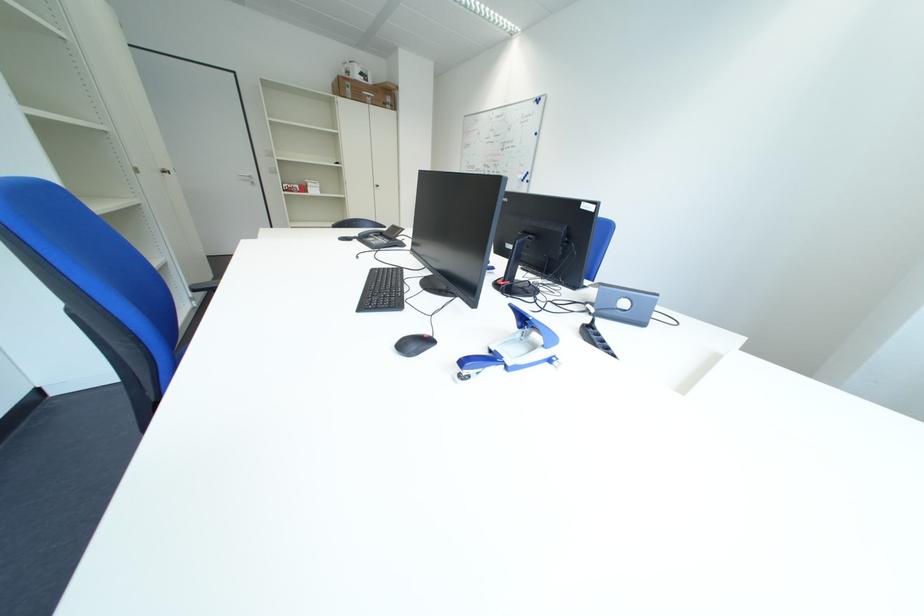
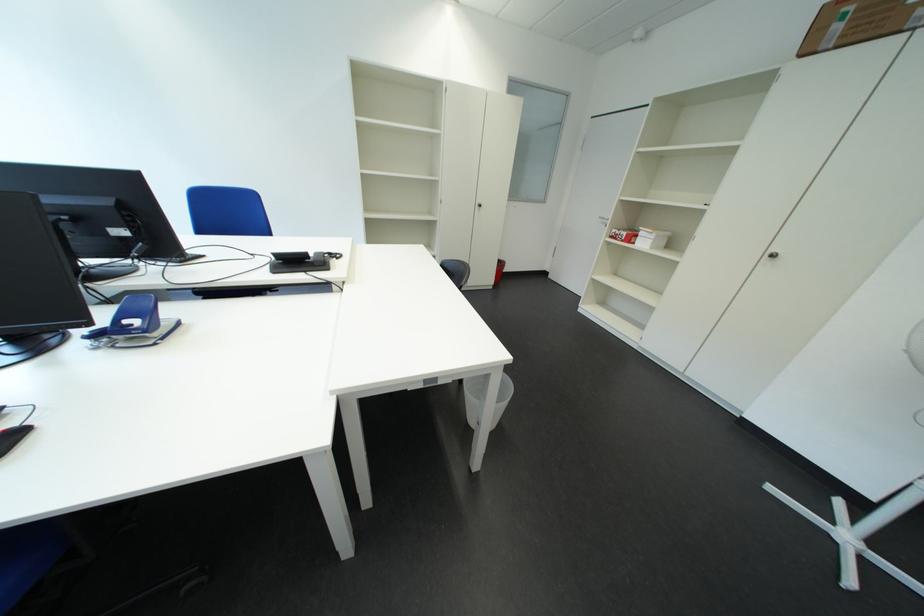
Locate, in the second image, the point that corresponds to [326,193] in the first image.

(657, 246)